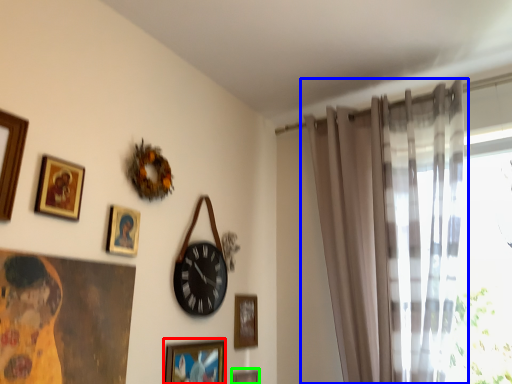
Question: Considering the real-world distances, which object is farthest from picture frame (highlighted by a red box)? curtain (highlighted by a blue box) or picture frame (highlighted by a green box)?

Choices:
 (A) curtain
 (B) picture frame

Answer: (A)